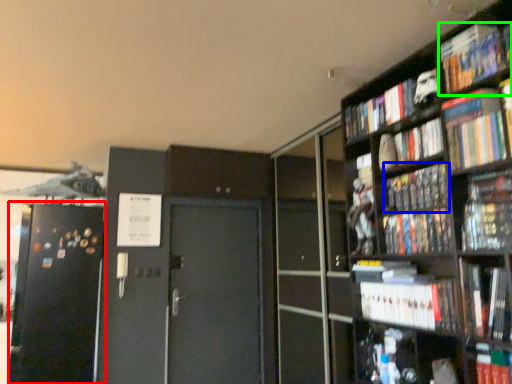
Question: Estimate the real-world distances between objects in this image. Which object is closer to fridge (highlighted by a red box), book (highlighted by a blue box) or book (highlighted by a green box)?

Choices:
 (A) book
 (B) book

Answer: (A)